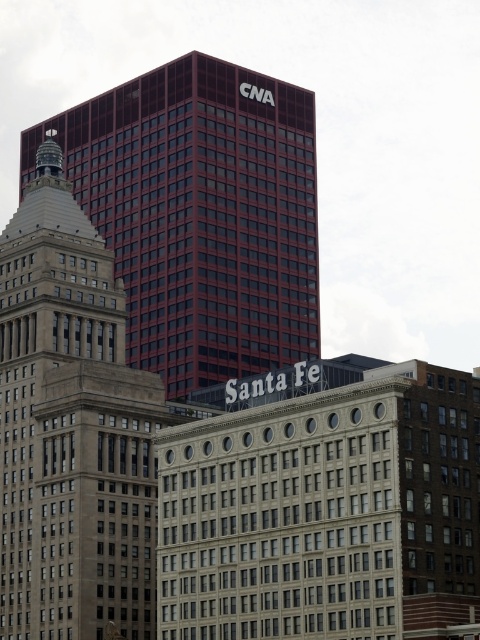
Who is higher up, maroon glass building at center or beige stone tower at center?

maroon glass building at center

Is point (75, 189) less distant than point (131, 417)?

No, (75, 189) is behind (131, 417).

This screenshot has height=640, width=480. Describe the element at coordinates (201, 214) in the screenshot. I see `maroon glass building at center` at that location.

Where is `maroon glass building at center`? The image size is (480, 640). maroon glass building at center is located at coordinates (201, 214).